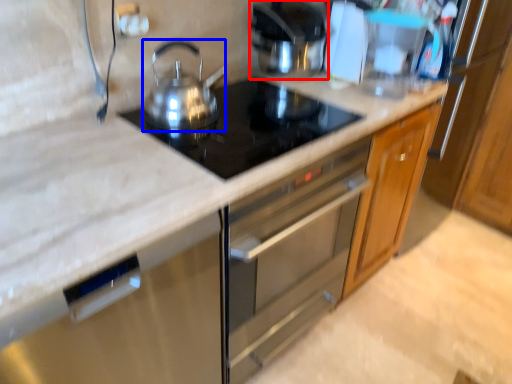
Question: Which point is further to the camera, kitchen appliance (highlighted by a red box) or kitchen appliance (highlighted by a blue box)?

Choices:
 (A) kitchen appliance
 (B) kitchen appliance

Answer: (A)